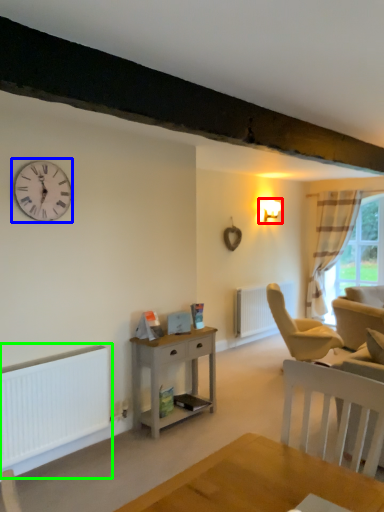
Question: Which object is the farthest from light fixture (highlighted by a red box)? Choose among these: wall clock (highlighted by a blue box) or heater (highlighted by a green box).

Choices:
 (A) wall clock
 (B) heater

Answer: (B)